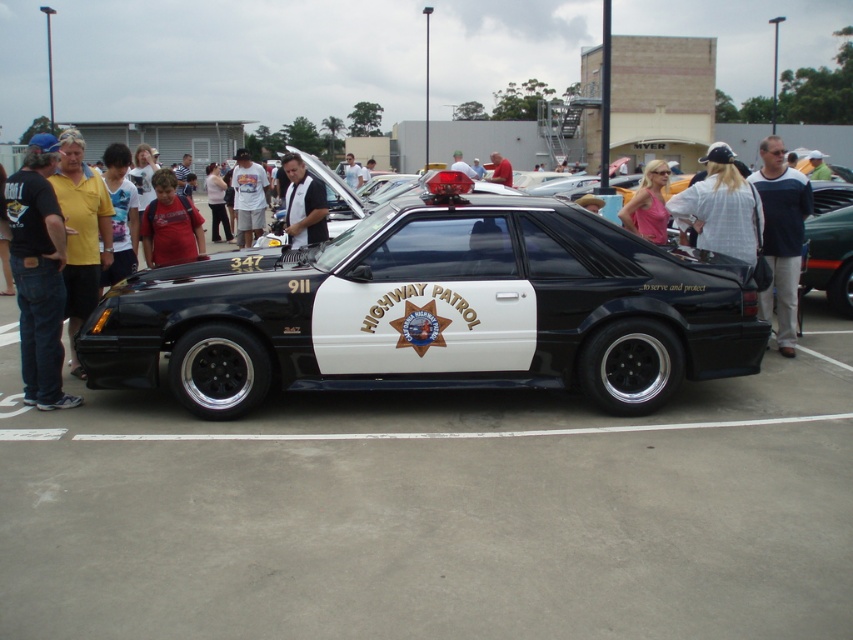
Which is more to the right, black matte police car at center or black leather shirt at center?

black matte police car at center

Which of these two, black matte police car at center or black leather shirt at center, stands taller?

black matte police car at center

Image resolution: width=853 pixels, height=640 pixels. In order to click on black matte police car at center in this screenshot , I will do `click(434, 310)`.

In order to click on black matte police car at center in this screenshot , I will do `click(434, 310)`.

Is matte red shirt at center positioned before metallic green car at center?

That is True.

Measure the distance between point (194, 216) and camera.

The distance of point (194, 216) from camera is 8.23 meters.

Which is behind, point (184, 234) or point (850, 307)?

Point (850, 307)

The width and height of the screenshot is (853, 640). I want to click on matte red shirt at center, so click(170, 225).

Does metallic green car at center come in front of pink fabric dress at upper center?

No.

Does metallic green car at center have a larger size compared to pink fabric dress at upper center?

Actually, metallic green car at center might be smaller than pink fabric dress at upper center.

The image size is (853, 640). I want to click on metallic green car at center, so click(x=830, y=257).